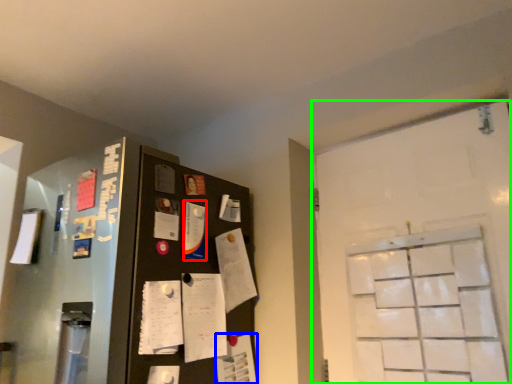
Question: Which is nearer to the paper (highlighted by a red box)? paper (highlighted by a blue box) or door (highlighted by a green box).

Choices:
 (A) paper
 (B) door

Answer: (A)